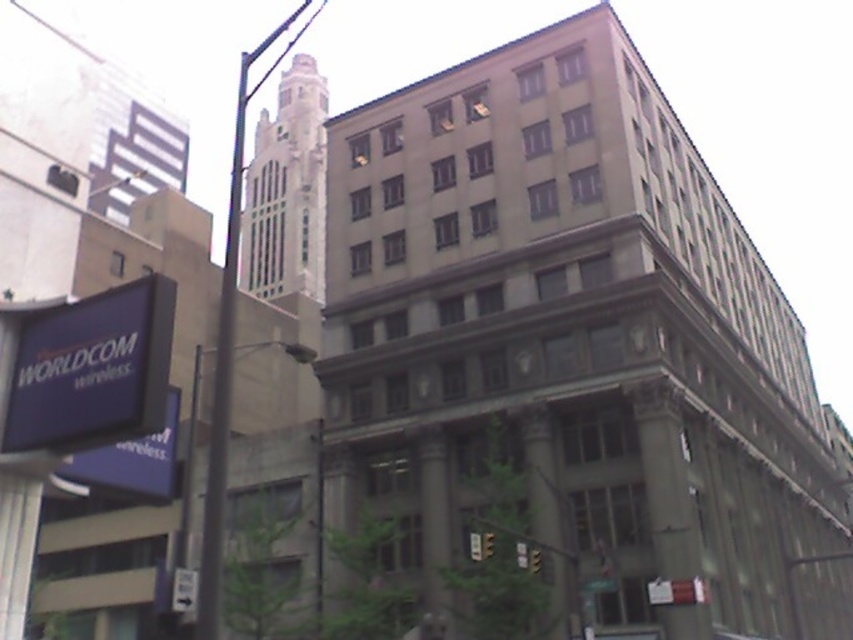
You are a pedestrian standing on the sidewalk and see the blue plastic sign at lower left and the metallic pole at left. Which object is closer to you?

The blue plastic sign at lower left is closer to you because it is positioned under the metallic pole at left, indicating it is in front of the pole from your perspective.